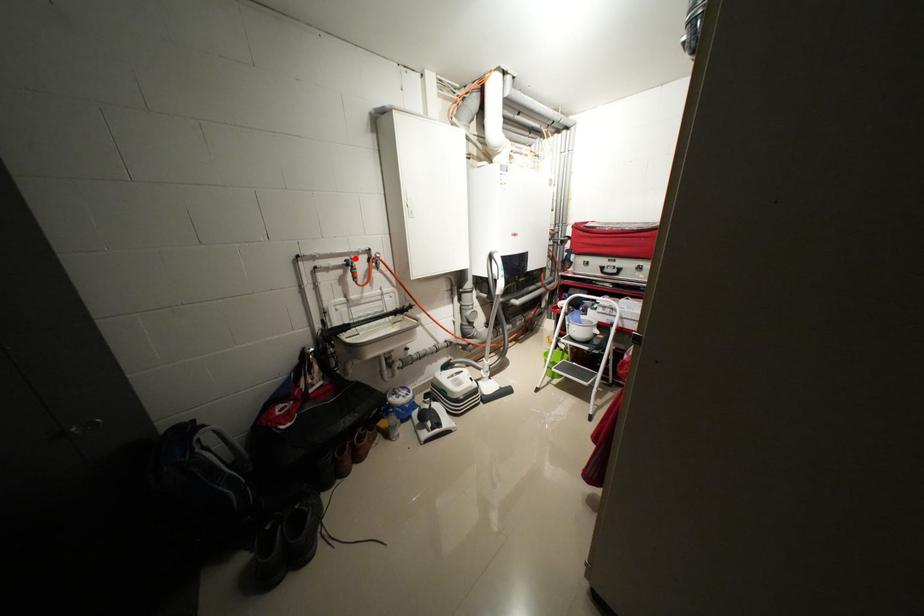
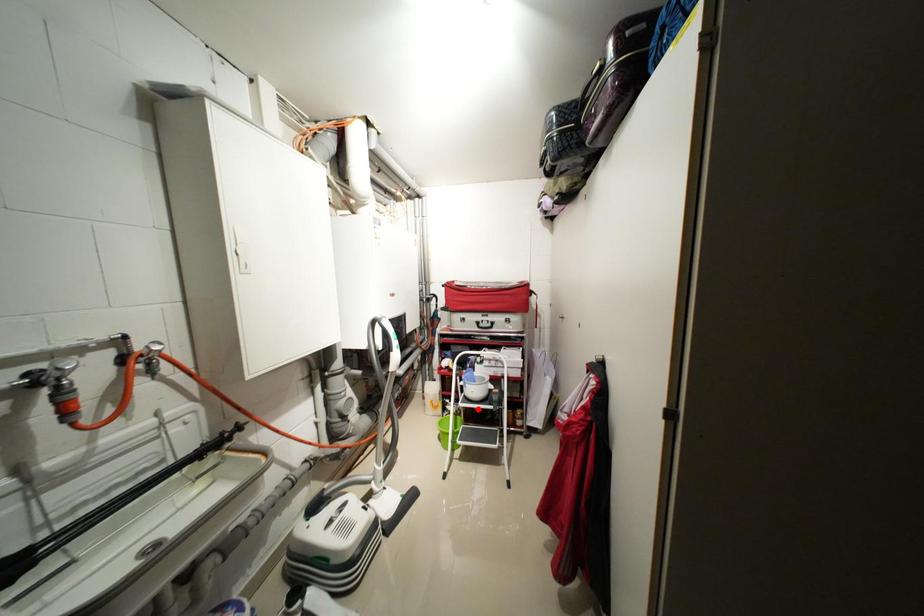
Based on the photo, I am providing you with two images of the same scene from different viewpoints. A red point is marked on the first image and another point is marked on the second image. Is the marked point in image1 the same physical position as the marked point in image2?

No